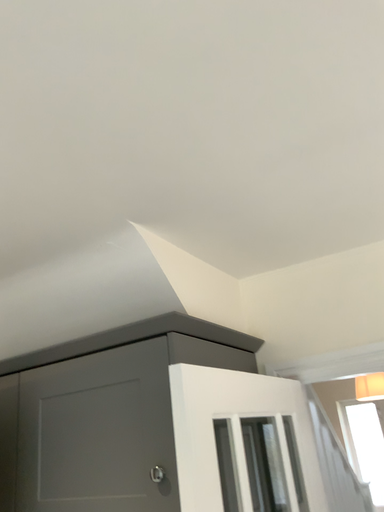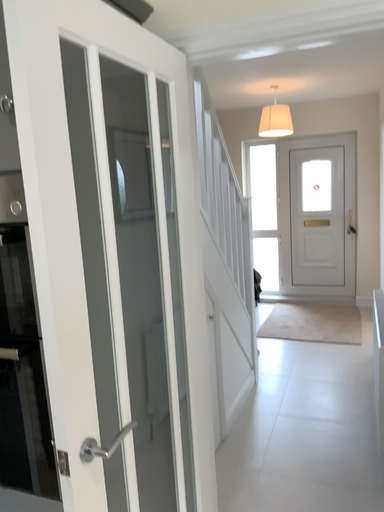
Question: How did the camera likely rotate when shooting the video?

Choices:
 (A) rotated upward
 (B) rotated downward

Answer: (B)